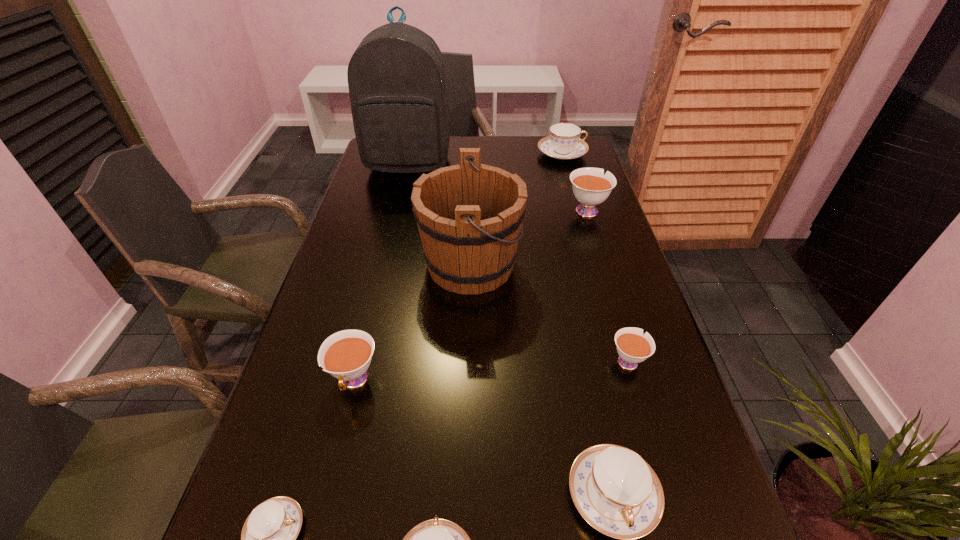
This screenshot has width=960, height=540. I want to click on free space between the second biggest white teacup and the biggest white teacup, so click(470, 295).

I want to click on object that is the third closest to the shortest object, so click(x=615, y=490).

You are a GUI agent. You are given a task and a screenshot of the screen. Output one action in this format:
    pyautogui.click(x=<x>, y=<y>)
    Task: Click on the object identified as the second closest to the smallest white teacup
    The image size is (960, 540).
    Given the screenshot: What is the action you would take?
    pyautogui.click(x=469, y=216)

Identify which teacup is located as the fourth nearest to the shortest teacup. Please provide its 2D coordinates. Your answer should be formatted as a tuple, i.e. [(x, y)], where the tuple contains the x and y coordinates of a point satisfying the conditions above.

[(633, 347)]

Point out which teacup is positioned as the third nearest to the smallest white teacup. Please provide its 2D coordinates. Your answer should be formatted as a tuple, i.e. [(x, y)], where the tuple contains the x and y coordinates of a point satisfying the conditions above.

[(590, 186)]

You are a GUI agent. You are given a task and a screenshot of the screen. Output one action in this format:
    pyautogui.click(x=<x>, y=<y>)
    Task: Click on the white teacup that stands as the closest to the wine bucket
    Image resolution: width=960 pixels, height=540 pixels.
    Given the screenshot: What is the action you would take?
    pyautogui.click(x=590, y=186)

At what (x,y) coordinates should I click in order to perform the action: click on white teacup that is the third nearest to the tallest object. Please return your answer as a coordinate pair (x, y). The height and width of the screenshot is (540, 960). Looking at the image, I should click on (633, 347).

I want to click on the closest blue teacup relative to the third teacup from left to right, so click(615, 490).

Image resolution: width=960 pixels, height=540 pixels. Find the location of `blue teacup that is the third closest to the shortest teacup`. blue teacup that is the third closest to the shortest teacup is located at coordinates (564, 143).

The image size is (960, 540). What are the coordinates of `free location that satisfies the following two spatial constraints: 1. on the side with the handle of the biggest blue teacup; 2. on the side of the third tallest object with the handle` in the screenshot? It's located at (578, 210).